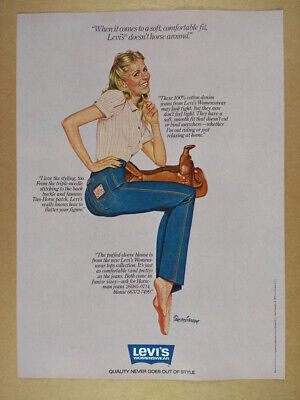
Where is `handle`? handle is located at coordinates (x=190, y=146).